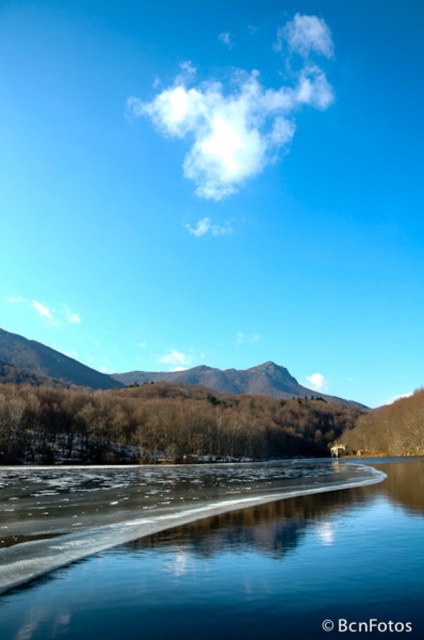
You are standing at the edge of the frozen lake and see the transparent ice at lower center and the brown matte trees at center. Which object is closer to you?

The transparent ice at lower center is closer to you because it is located above the brown matte trees at center, which places it in a lower position in the image and thus nearer to the viewer.